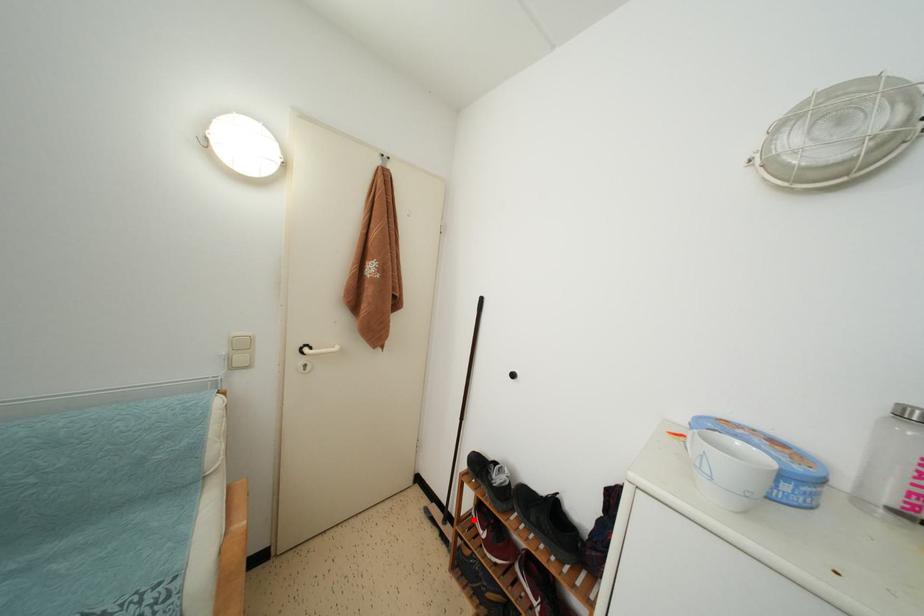
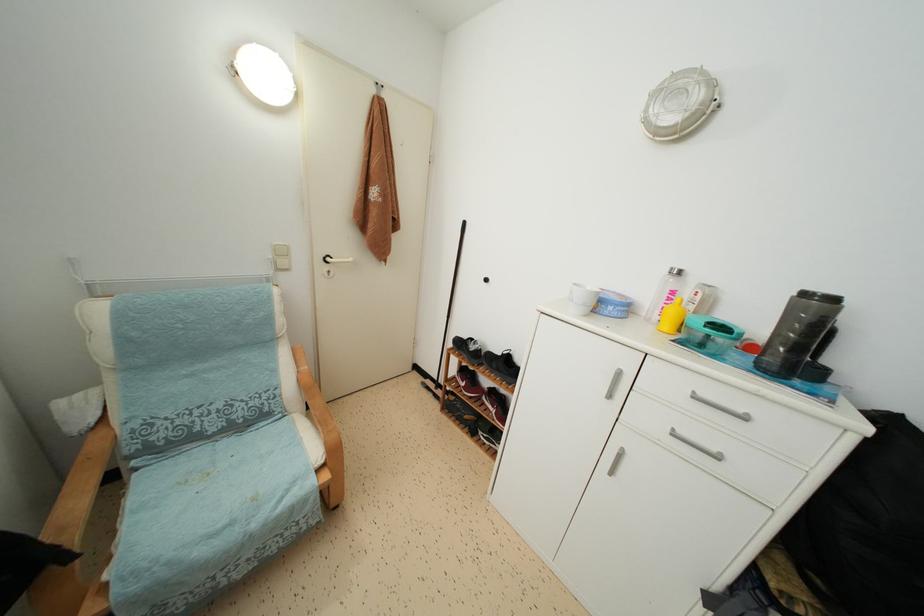
Where in the second image is the point corresponding to the highlighted location from the first image?

(457, 383)